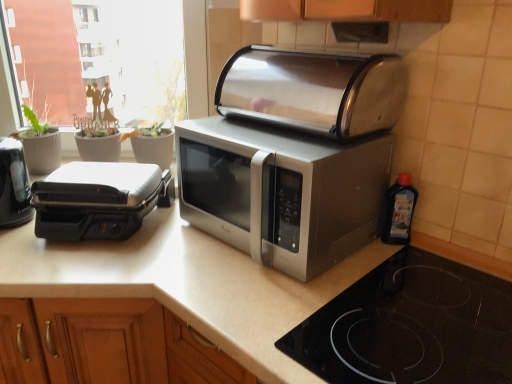
Where is `free location above satin silver microwave at center (from a real-world perspective)`? This screenshot has height=384, width=512. free location above satin silver microwave at center (from a real-world perspective) is located at coordinates point(265,134).